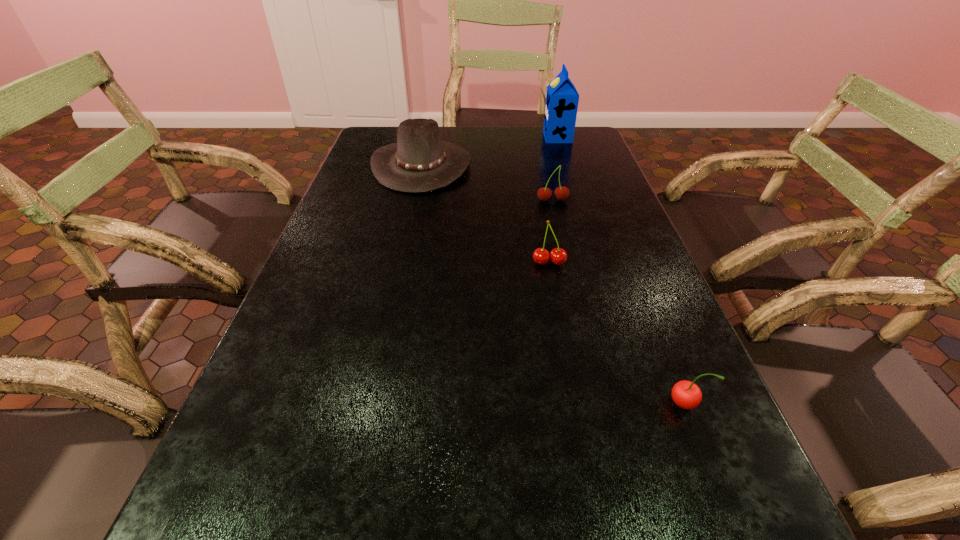
At what (x,y) coordinates should I click in order to perform the action: click on vacant region located on the surface of the third nearest object. Please return your answer as a coordinate pair (x, y). This screenshot has width=960, height=540. Looking at the image, I should click on (561, 237).

Identify the location of vacant space located 0.390m with the stems of the fourth farthest object pointing upwards. Image resolution: width=960 pixels, height=540 pixels. (579, 422).

Where is `vacant region located 0.180m on the left of the rightmost cherry`? The image size is (960, 540). vacant region located 0.180m on the left of the rightmost cherry is located at coordinates (562, 403).

In order to click on carton that is at the far edge in this screenshot , I will do `click(562, 98)`.

At what (x,y) coordinates should I click in order to perform the action: click on hat present at the far edge. Please return your answer as a coordinate pair (x, y). The height and width of the screenshot is (540, 960). Looking at the image, I should click on (420, 162).

The width and height of the screenshot is (960, 540). I want to click on object that is positioned at the left edge, so [420, 162].

In order to click on carton at the right edge in this screenshot , I will do `click(562, 98)`.

Identify the location of object positioned at the far left corner. This screenshot has height=540, width=960. (420, 162).

Identify the location of object that is at the far right corner. (562, 98).

This screenshot has height=540, width=960. In the image, there is a desktop. In order to click on vacant area at the far edge in this screenshot , I will do `click(459, 136)`.